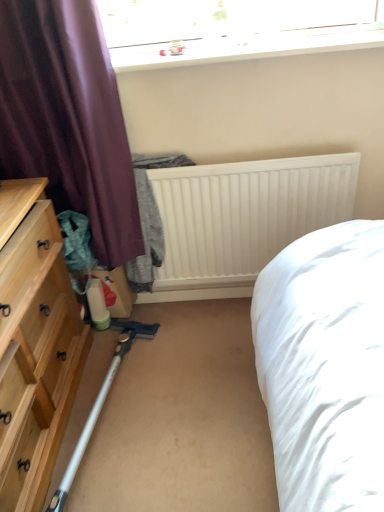
Describe the element at coordinates (68, 119) in the screenshot. This screenshot has width=384, height=512. I see `purple fabric curtain at left` at that location.

The image size is (384, 512). Find the location of `natural wood dresser at left`. natural wood dresser at left is located at coordinates (34, 345).

Where is `white plastic vacuum cleaner at lower left`? The width and height of the screenshot is (384, 512). white plastic vacuum cleaner at lower left is located at coordinates (100, 403).

Is natural wood dresser at left not inside white plastic vacuum cleaner at lower left?

Yes.

Can you confirm if natural wood dresser at left is positioned to the left of white plastic vacuum cleaner at lower left?

Yes.

Is point (26, 335) farther from viewer compared to point (150, 327)?

No, (26, 335) is closer to viewer.

Which of these two, white matte radiator at center or transparent glass window at upper center, is wider?

Wider between the two is transparent glass window at upper center.

Is white matte radiator at center positioned with its back to transparent glass window at upper center?

No.

From a real-world perspective, is white matte radiator at center above or below transparent glass window at upper center?

Clearly, from a real-world perspective, white matte radiator at center is below transparent glass window at upper center.

From the image's perspective, is white plastic vacuum cleaner at lower left over purple fabric curtain at left?

No, from the image's perspective, white plastic vacuum cleaner at lower left is not above purple fabric curtain at left.

In the scene shown: Is white plastic vacuum cleaner at lower left positioned with its back to purple fabric curtain at left?

That's not correct — white plastic vacuum cleaner at lower left is not looking away from purple fabric curtain at left.

Looking at this image, how far apart are white plastic vacuum cleaner at lower left and purple fabric curtain at left?

The distance of white plastic vacuum cleaner at lower left from purple fabric curtain at left is 33.99 inches.

Which object is wider, white plastic vacuum cleaner at lower left or purple fabric curtain at left?

Wider between the two is purple fabric curtain at left.

Identify the location of equipment lying below the natural wood dresser at left (from the image's perspective). The width and height of the screenshot is (384, 512). (100, 403).

Considering their positions, is white plastic vacuum cleaner at lower left located in front of or behind natural wood dresser at left?

Visually, white plastic vacuum cleaner at lower left is located behind natural wood dresser at left.

Would you say white plastic vacuum cleaner at lower left is a long distance from natural wood dresser at left?

white plastic vacuum cleaner at lower left is actually quite close to natural wood dresser at left.

Which is behind, point (75, 463) or point (13, 503)?

The point (75, 463) is farther.

Relative to white plastic vacuum cleaner at lower left, is white matte radiator at center in front or behind?

Visually, white matte radiator at center is located behind white plastic vacuum cleaner at lower left.

Based on the photo, how much distance is there between white matte radiator at center and white plastic vacuum cleaner at lower left?

white matte radiator at center and white plastic vacuum cleaner at lower left are 68.08 centimeters apart.

The width and height of the screenshot is (384, 512). In order to click on equipment located below the white matte radiator at center (from the image's perspective) in this screenshot , I will do point(100,403).

Looking at this image, who is taller, white matte radiator at center or white plastic vacuum cleaner at lower left?

white matte radiator at center.

Does natural wood dresser at left have a larger size compared to purple fabric curtain at left?

Indeed, natural wood dresser at left has a larger size compared to purple fabric curtain at left.

Is natural wood dresser at left looking in the opposite direction of purple fabric curtain at left?

natural wood dresser at left is not turned away from purple fabric curtain at left.

Considering the points (3, 490) and (26, 71), which point is behind, point (3, 490) or point (26, 71)?

The point (26, 71) is behind.

Considering the points (133, 337) and (332, 25), which point is in front, point (133, 337) or point (332, 25)?

Positioned in front is point (332, 25).

Image resolution: width=384 pixels, height=512 pixels. Identify the location of window behind the white plastic vacuum cleaner at lower left. (233, 29).

From the image's perspective, does white plastic vacuum cleaner at lower left appear higher than transparent glass window at upper center?

Incorrect, from the image's perspective, white plastic vacuum cleaner at lower left is lower than transparent glass window at upper center.

This screenshot has height=512, width=384. What are the coordinates of `the chest of drawers above the white plastic vacuum cleaner at lower left (from the image's perspective)` in the screenshot? It's located at (34, 345).

At what (x,y) coordinates should I click in order to perform the action: click on window in front of the white matte radiator at center. Please return your answer as a coordinate pair (x, y). Looking at the image, I should click on (233, 29).

Which object lies further to the anchor point purple fabric curtain at left, white matte radiator at center or transparent glass window at upper center?

transparent glass window at upper center.

When comparing their distances from purple fabric curtain at left, does white plastic vacuum cleaner at lower left or white matte radiator at center seem closer?

Based on the image, white matte radiator at center appears to be nearer to purple fabric curtain at left.

Which object lies nearer to the anchor point white plastic vacuum cleaner at lower left, white matte radiator at center or purple fabric curtain at left?

Among the two, white matte radiator at center is located nearer to white plastic vacuum cleaner at lower left.

Considering their positions, is white matte radiator at center positioned further to transparent glass window at upper center than white plastic vacuum cleaner at lower left?

white plastic vacuum cleaner at lower left.

From the image, which object appears to be nearer to white plastic vacuum cleaner at lower left, purple fabric curtain at left or transparent glass window at upper center?

Among the two, purple fabric curtain at left is located nearer to white plastic vacuum cleaner at lower left.

When comparing their distances from white matte radiator at center, does natural wood dresser at left or transparent glass window at upper center seem further?

natural wood dresser at left is positioned further to the anchor white matte radiator at center.

Looking at the image, which one is located further to transparent glass window at upper center, natural wood dresser at left or white plastic vacuum cleaner at lower left?

white plastic vacuum cleaner at lower left is further to transparent glass window at upper center.

Which object lies nearer to the anchor point white matte radiator at center, purple fabric curtain at left or white plastic vacuum cleaner at lower left?

Among the two, purple fabric curtain at left is located nearer to white matte radiator at center.

Locate an element on the screen. radiator between purple fabric curtain at left and white plastic vacuum cleaner at lower left in the up-down direction is located at coordinates (245, 214).

Image resolution: width=384 pixels, height=512 pixels. In order to click on equipment between natural wood dresser at left and white matte radiator at center in the horizontal direction in this screenshot , I will do `click(100, 403)`.

At what (x,y) coordinates should I click in order to perform the action: click on radiator between transparent glass window at upper center and white plastic vacuum cleaner at lower left from top to bottom. Please return your answer as a coordinate pair (x, y). Looking at the image, I should click on (245, 214).

The height and width of the screenshot is (512, 384). What are the coordinates of `curtain between transparent glass window at upper center and white plastic vacuum cleaner at lower left from top to bottom` in the screenshot? It's located at (68, 119).